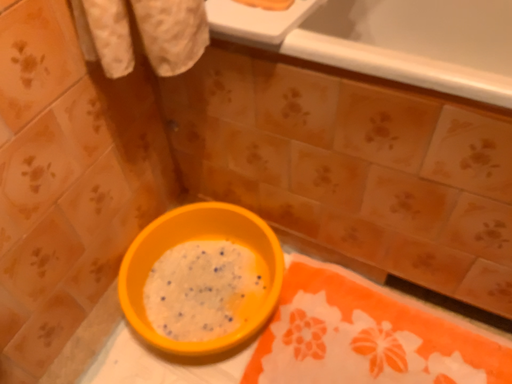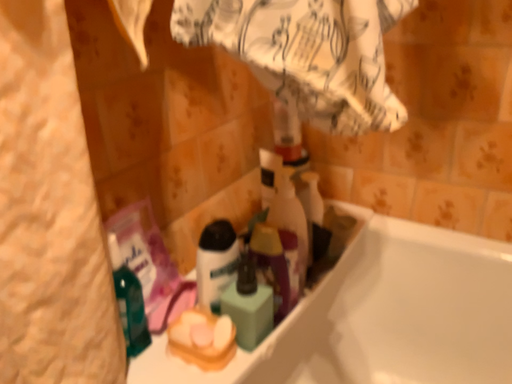
Question: How did the camera likely rotate when shooting the video?

Choices:
 (A) rotated downward
 (B) rotated upward

Answer: (B)